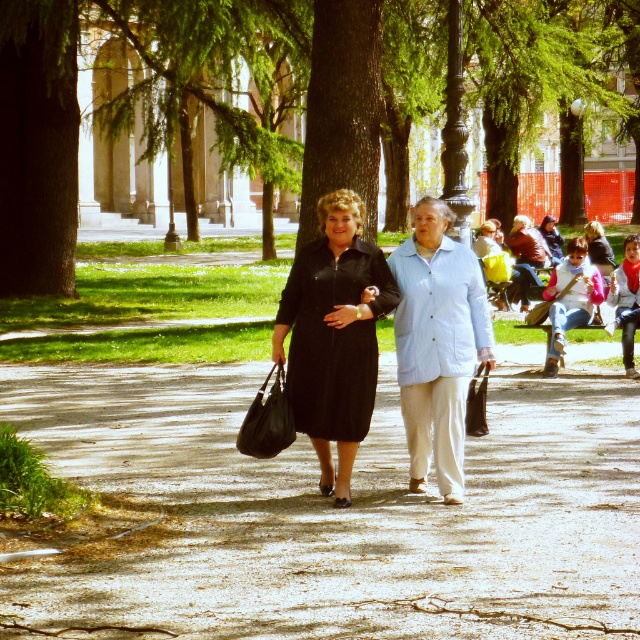
Question: Can you confirm if dull concrete pavement at center is wider than green leafy tree at center?

Choices:
 (A) yes
 (B) no

Answer: (B)

Question: Estimate the real-world distances between objects in this image. Which object is farther from the dull concrete pavement at center?

Choices:
 (A) matte black dress at center
 (B) green leafy tree at center

Answer: (B)

Question: Which point is farther to the camera?

Choices:
 (A) (362, 65)
 (B) (24, 198)

Answer: (B)

Question: Is green leafy tree at center wider than matte black dress at center?

Choices:
 (A) yes
 (B) no

Answer: (A)

Question: Which point is closer to the camera?

Choices:
 (A) (13, 19)
 (B) (378, 256)

Answer: (B)

Question: Considering the relative positions of dull concrete pavement at center and green leafy tree at center in the image provided, where is dull concrete pavement at center located with respect to green leafy tree at center?

Choices:
 (A) right
 (B) left

Answer: (B)